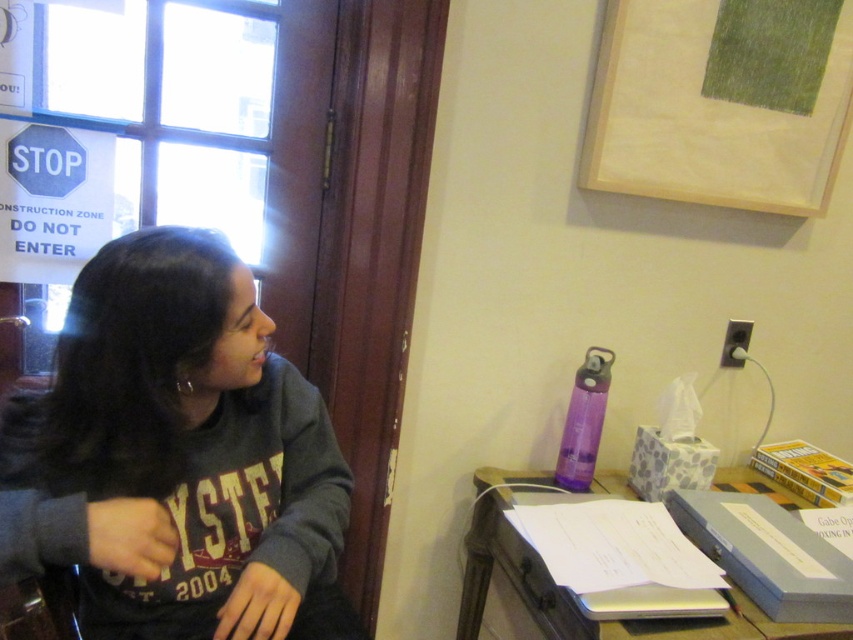
Question: Which point is farther to the camera?

Choices:
 (A) metallic silver laptop at center
 (B) gray fleece sweatshirt at center

Answer: (A)

Question: Does gray fleece sweatshirt at center have a greater width compared to metallic silver laptop at center?

Choices:
 (A) no
 (B) yes

Answer: (A)

Question: Which point appears farthest from the camera in this image?

Choices:
 (A) (148, 476)
 (B) (650, 632)

Answer: (B)

Question: Can you confirm if gray fleece sweatshirt at center is positioned above metallic silver laptop at center?

Choices:
 (A) no
 (B) yes

Answer: (B)

Question: Is gray fleece sweatshirt at center closer to camera compared to metallic silver laptop at center?

Choices:
 (A) yes
 (B) no

Answer: (A)